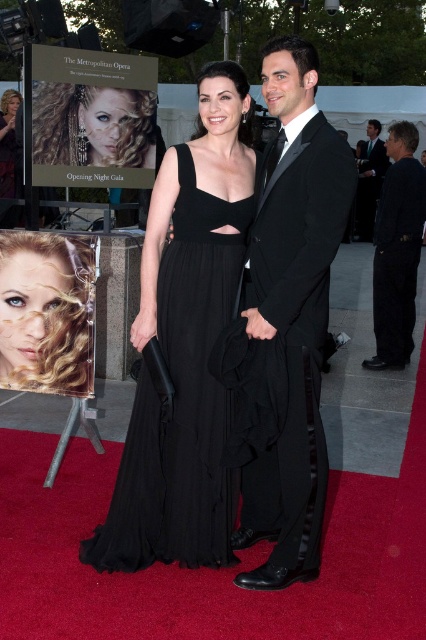
Question: Is matte black dress at center smaller than blonde curly hair at center?

Choices:
 (A) yes
 (B) no

Answer: (B)

Question: Which of the following is the farthest from the observer?

Choices:
 (A) (379, 234)
 (B) (138, 381)
 (C) (140, 140)
 (D) (360, 180)

Answer: (D)

Question: Which object is positioned closest to the blonde curly hair at center?

Choices:
 (A) matte black dress at center
 (B) shiny black suit at center
 (C) black cotton pants at right

Answer: (A)

Question: Based on their relative distances, which object is farther from the shiny gold hair at upper left?

Choices:
 (A) black satin suit at right
 (B) blonde curly hair at center
 (C) black cotton pants at right

Answer: (A)

Question: Considering the relative positions of black chiffon dress at center and shiny gold hair at upper left in the image provided, where is black chiffon dress at center located with respect to shiny gold hair at upper left?

Choices:
 (A) left
 (B) right

Answer: (B)

Question: Is matte black dress at center smaller than black cotton pants at right?

Choices:
 (A) yes
 (B) no

Answer: (B)